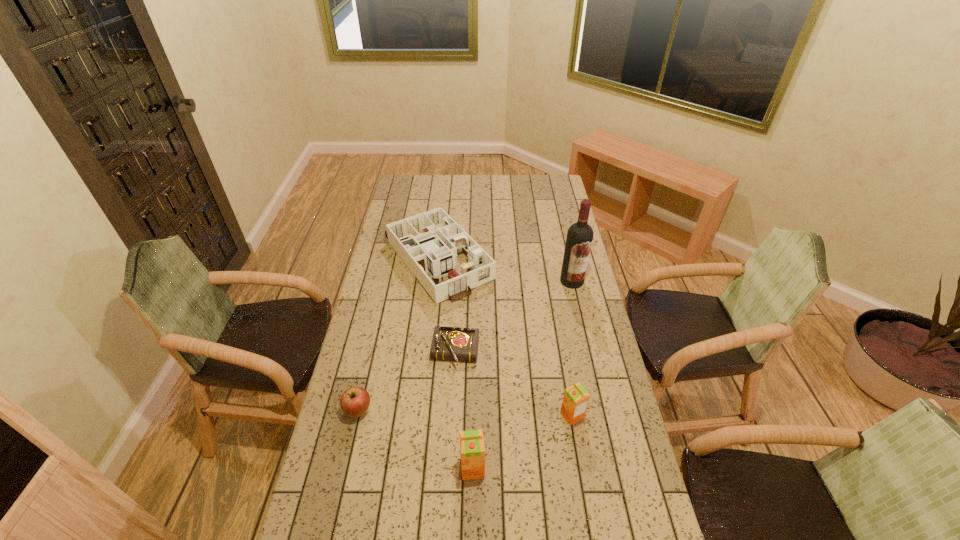
Please show where to add a orange juice on the left while keeping spacing even. Please provide its 2D coordinates. Your answer should be formatted as a tuple, i.e. [(x, y)], where the tuple contains the x and y coordinates of a point satisfying the conditions above.

[(351, 532)]